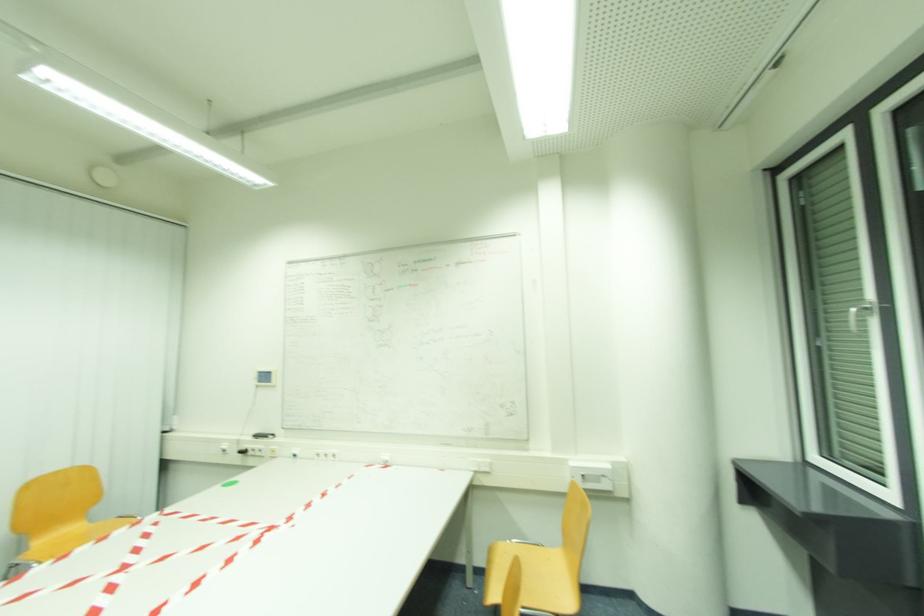
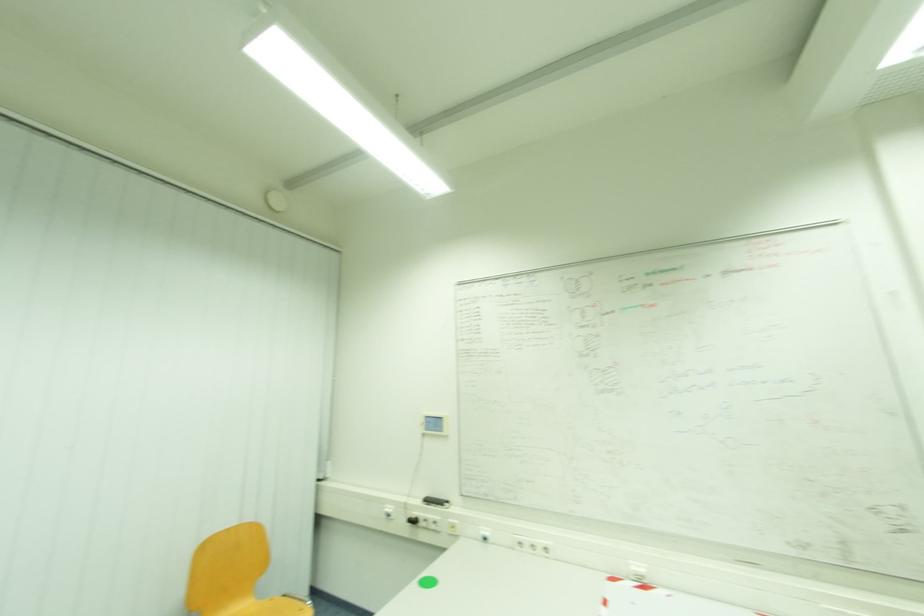
Which direction would the cameraman need to move to produce the second image?

The cameraman moved toward left, forward.